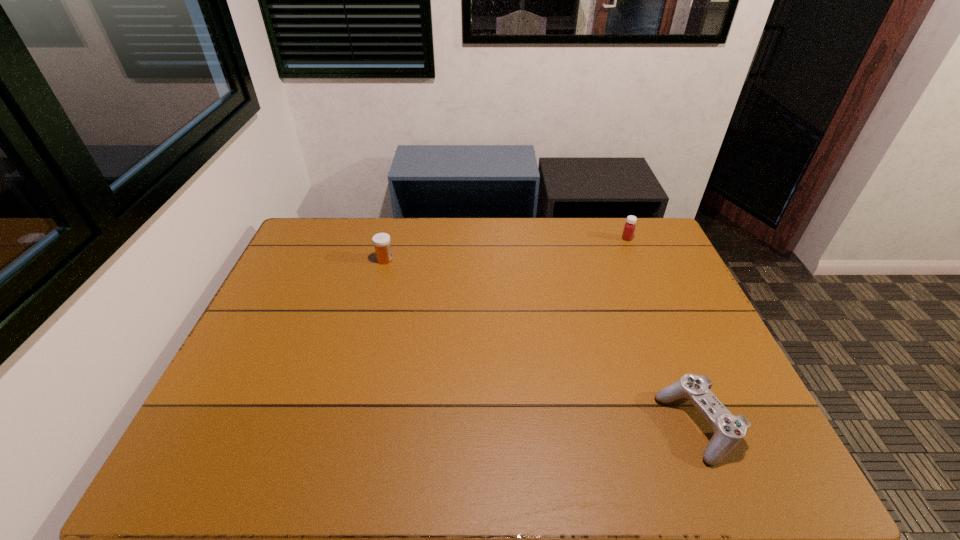
Image resolution: width=960 pixels, height=540 pixels. I want to click on vacant region that satisfies the following two spatial constraints: 1. on the front side of the left medicine; 2. on the right side of the control, so click(342, 426).

I want to click on free point that satisfies the following two spatial constraints: 1. on the front side of the control; 2. on the right side of the second nearest object, so click(x=342, y=426).